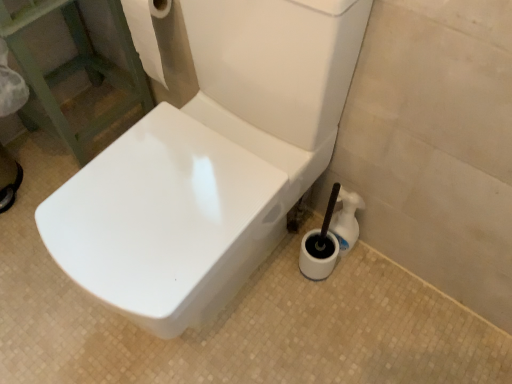
Question: Visually, is white glossy toilet brush at lower right positioned to the left or to the right of white glossy toilet at center?

Choices:
 (A) left
 (B) right

Answer: (B)

Question: Considering their positions, is white glossy toilet brush at lower right located in front of or behind white glossy toilet at center?

Choices:
 (A) front
 (B) behind

Answer: (B)

Question: Which of these objects is positioned farthest from the white glossy toilet brush at lower right?

Choices:
 (A) white glossy toilet at center
 (B) white paper towel at upper left

Answer: (B)

Question: Based on their relative distances, which object is farther from the white paper towel at upper left?

Choices:
 (A) white glossy toilet brush at lower right
 (B) white glossy toilet at center

Answer: (A)